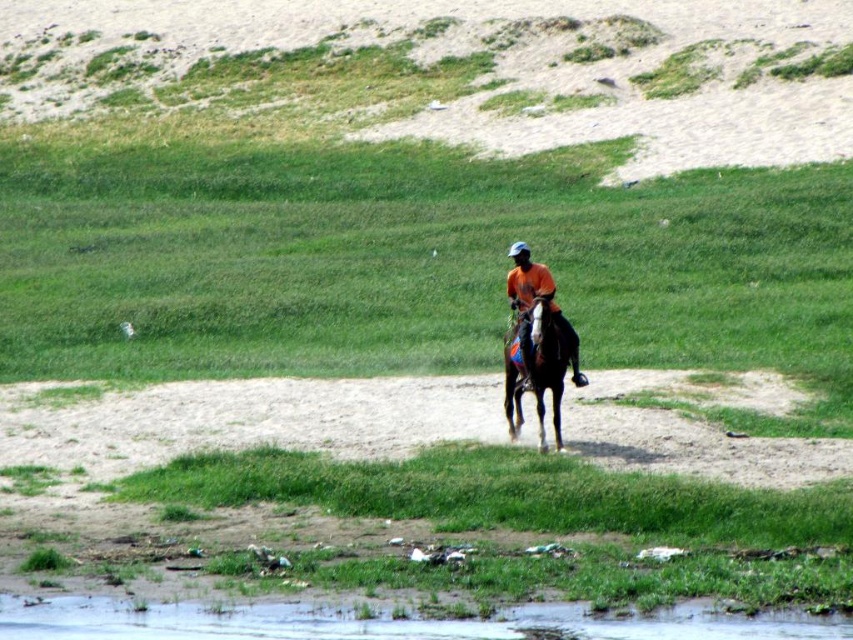
Is point (16, 321) farther from camera compared to point (556, 321)?

Yes, point (16, 321) is behind point (556, 321).

In the scene shown: Who is positioned more to the left, green grassy field at center or orange cotton shirt at center?

green grassy field at center

Find the location of a particular element. The image size is (853, 640). green grassy field at center is located at coordinates (405, 259).

Between green grassy field at center and brown sandy ground at lower center, which one appears on the left side from the viewer's perspective?

green grassy field at center is more to the left.

How much distance is there between green grassy field at center and brown sandy ground at lower center?

They are 9.78 meters apart.

The height and width of the screenshot is (640, 853). Describe the element at coordinates (405, 259) in the screenshot. I see `green grassy field at center` at that location.

Locate an element on the screen. This screenshot has height=640, width=853. green grassy field at center is located at coordinates (405, 259).

In the scene shown: Can you confirm if green grassy field at center is bigger than shiny brown horse at center?

Indeed, green grassy field at center has a larger size compared to shiny brown horse at center.

Is point (6, 148) positioned behind point (509, 419)?

Yes.

Identify the location of green grassy field at center. (405, 259).